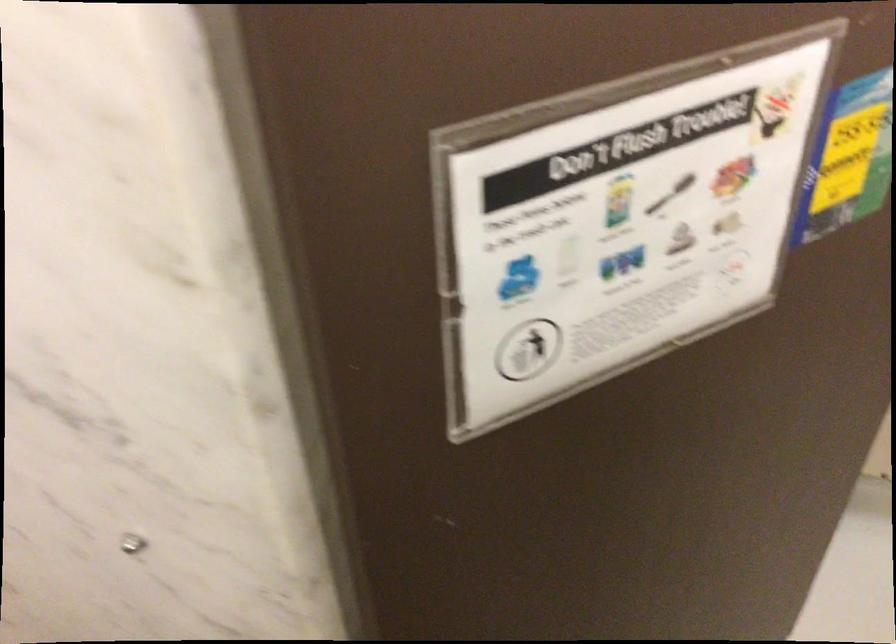
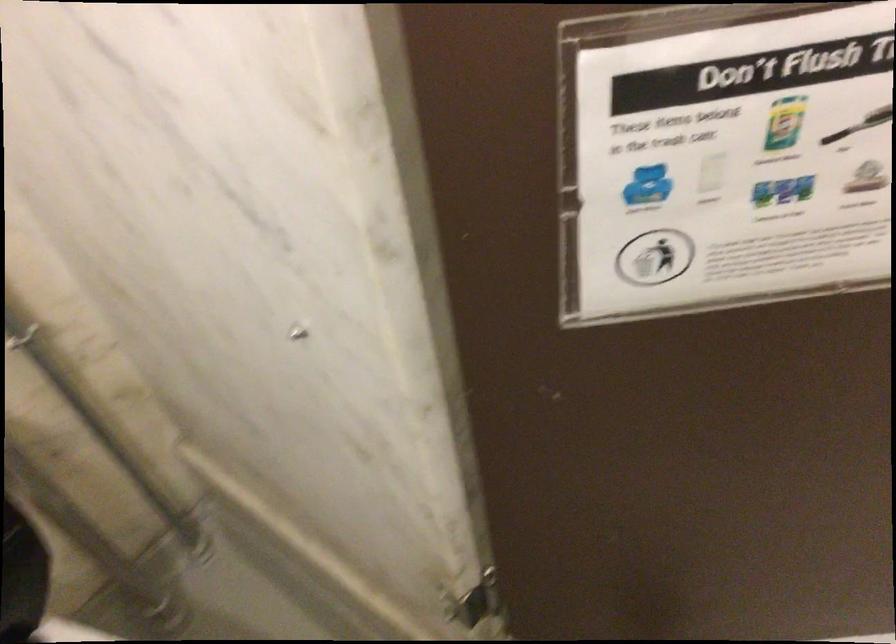
Question: How did the camera likely rotate?

Choices:
 (A) Left
 (B) Right
 (C) Up
 (D) Down

Answer: (A)